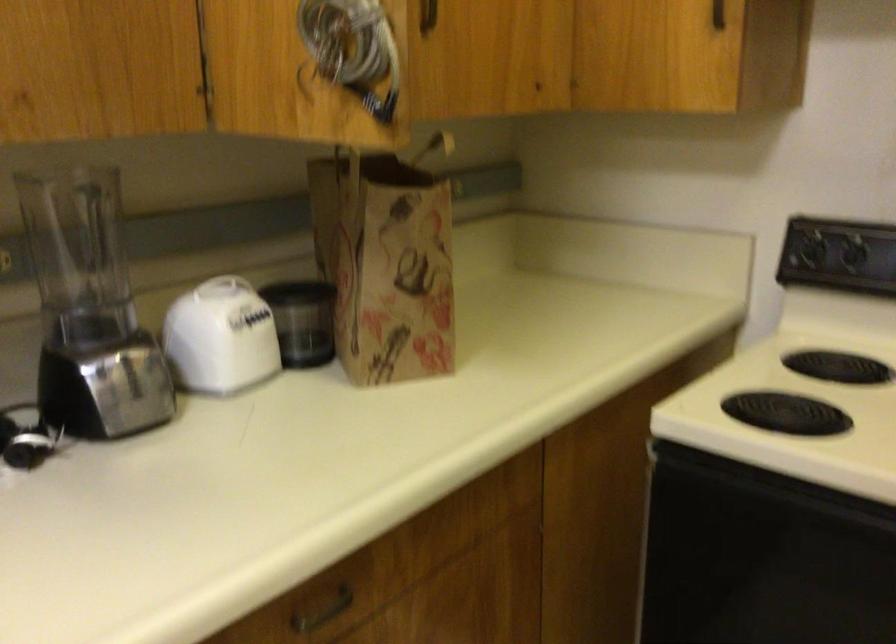
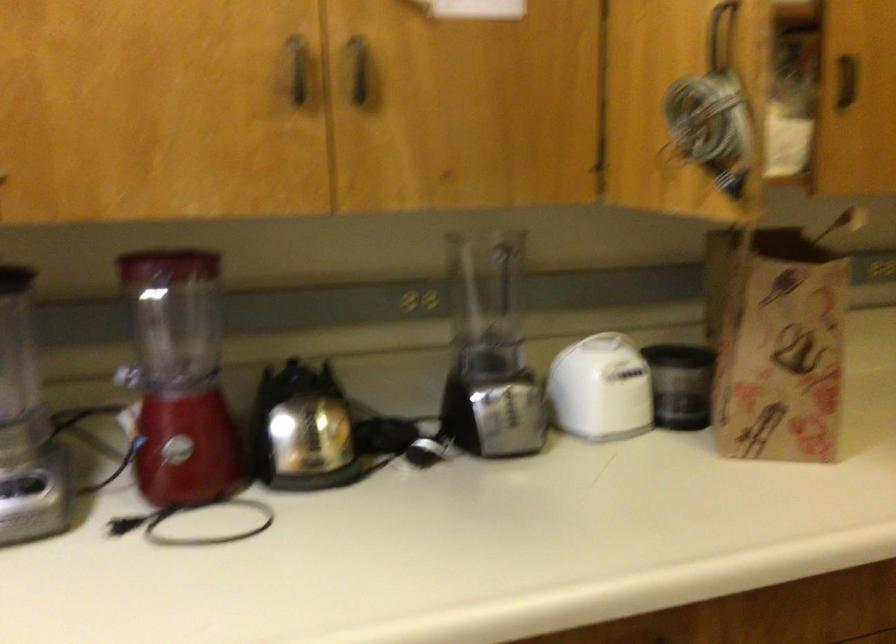
Question: I am providing you with two images of the same scene from different viewpoints. After the viewpoint changes to image2, which objects are now occluded?

Choices:
 (A) paper bag
 (B) dark cabinet handle
 (C) red blender pitcher
 (D) none of these

Answer: (D)